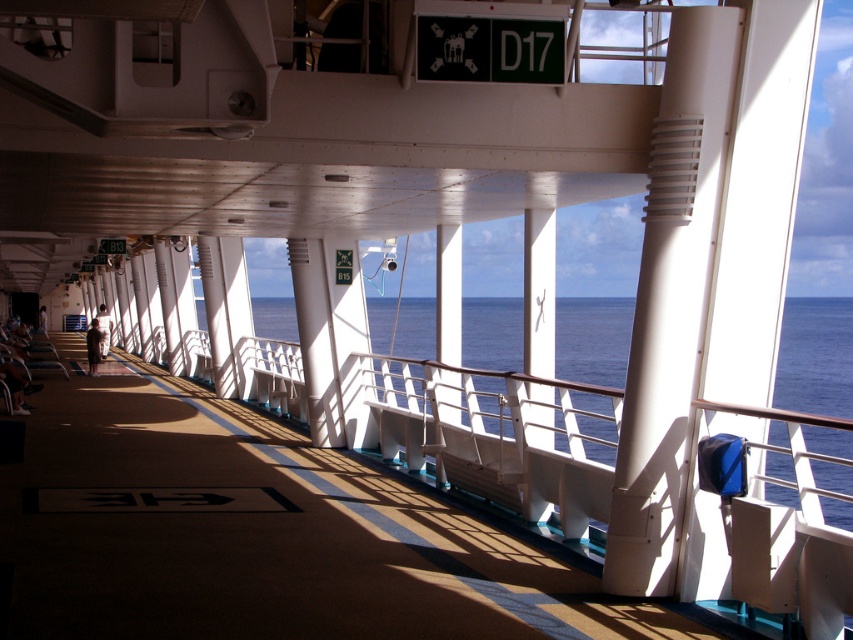
You are standing at the point labeled as point [815,356] on the cruise ship deck. Looking around, you see the blue water at center. Which direction should you walk to reach the blue water at center from your current position?

The point [815,356] corresponds to the blue water at center, so you are already at the blue water at center.

You are a passenger on the cruise ship and want to retrieve your dark brown leather jacket from the lounge area. You see the brown carpet at center and the dark brown leather jacket at left. Where is the jacket located relative to the carpet?

The dark brown leather jacket at left is located above the brown carpet at center.

You are standing on the cruise ship deck and want to walk from the brown carpet at center to the blue water at center. Which direction should you move in?

The brown carpet at center is to the left of blue water at center, so you should move to the right to reach the blue water at center from the brown carpet at center.